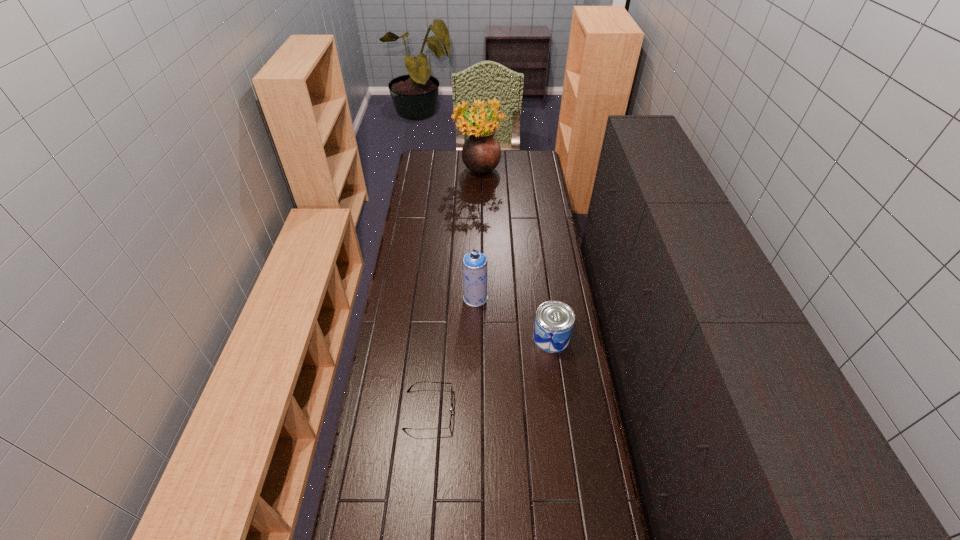
Image resolution: width=960 pixels, height=540 pixels. In order to click on the tallest object in this screenshot , I will do `click(481, 153)`.

Image resolution: width=960 pixels, height=540 pixels. In order to click on flower arrangement in this screenshot , I will do `click(481, 153)`.

You are a GUI agent. You are given a task and a screenshot of the screen. Output one action in this format:
    pyautogui.click(x=<x>, y=<y>)
    Task: Click on the third nearest object
    This screenshot has height=540, width=960.
    Given the screenshot: What is the action you would take?
    pyautogui.click(x=474, y=263)

Where is `aerosol can`? aerosol can is located at coordinates (474, 263).

The image size is (960, 540). I want to click on the second nearest object, so click(x=554, y=321).

Find the location of a particular element. The width and height of the screenshot is (960, 540). the rightmost object is located at coordinates (554, 321).

At what (x,y) coordinates should I click in order to perform the action: click on spectacles. Please return your answer as a coordinate pair (x, y). This screenshot has width=960, height=540. Looking at the image, I should click on click(x=418, y=382).

Locate an element on the screen. This screenshot has height=540, width=960. the nearest object is located at coordinates (418, 382).

Where is `vacant space located 0.170m on the front of the farthest object`? The width and height of the screenshot is (960, 540). vacant space located 0.170m on the front of the farthest object is located at coordinates (479, 208).

I want to click on vacant space located 0.230m on the right of the second farthest object, so click(x=542, y=298).